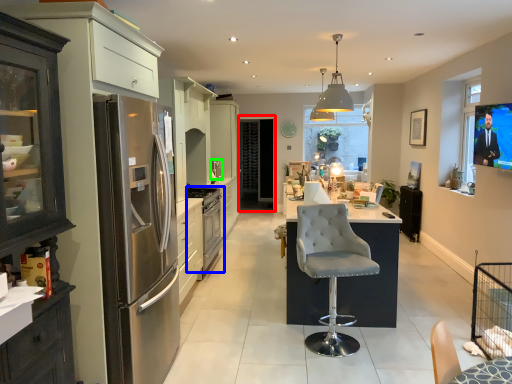
Question: Estimate the real-world distances between objects in this image. Which object is farther from glass door (highlighted by a red box), kitchen appliance (highlighted by a blue box) or appliance (highlighted by a green box)?

Choices:
 (A) kitchen appliance
 (B) appliance

Answer: (A)